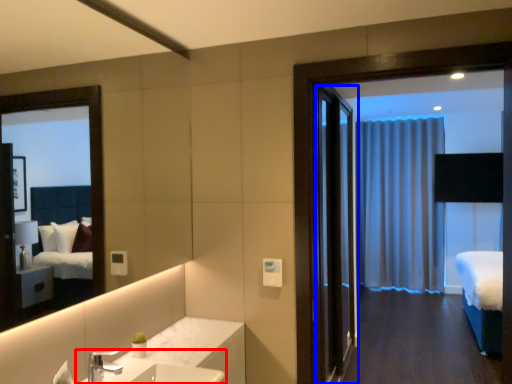
Question: Among these objects, which one is nearest to the camera, sink (highlighted by a red box) or door (highlighted by a blue box)?

Choices:
 (A) sink
 (B) door

Answer: (A)